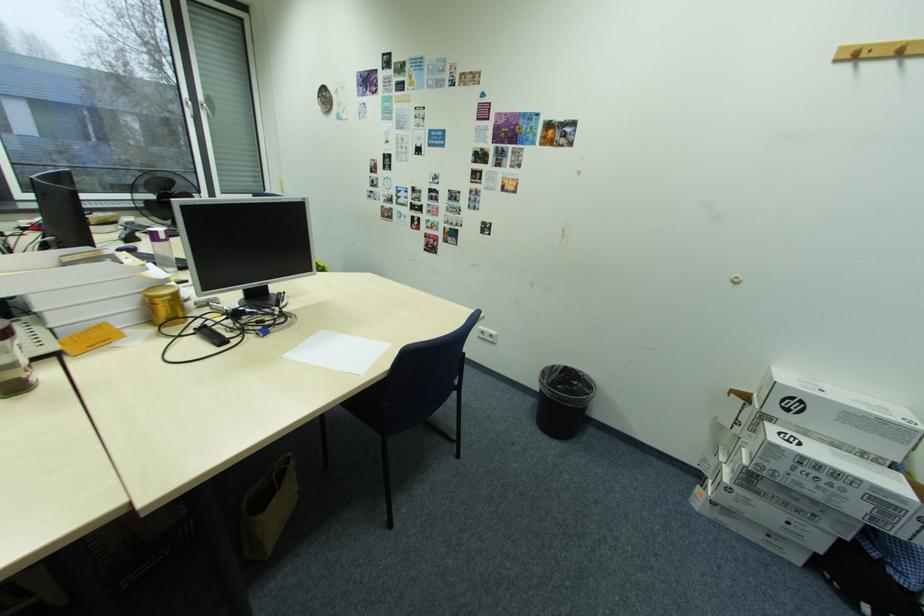
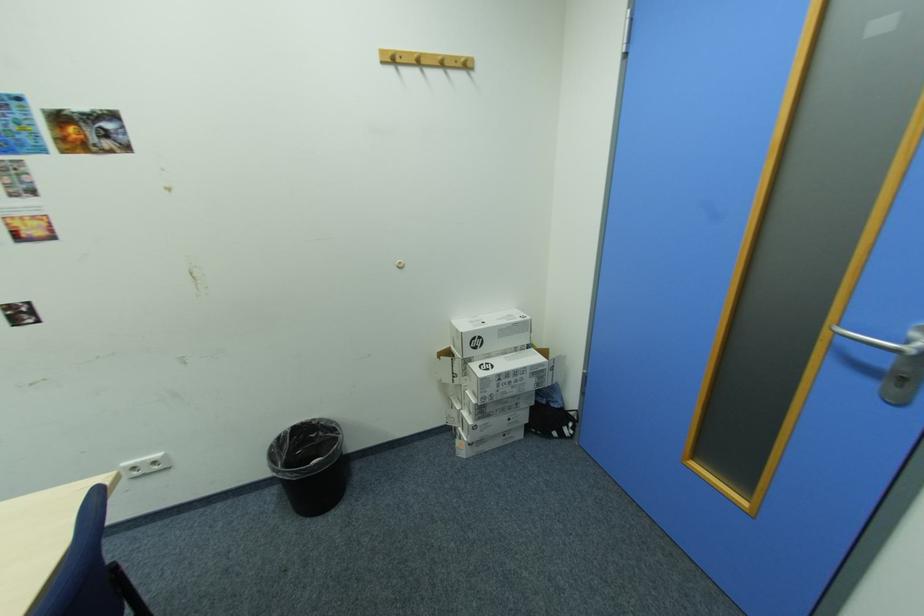
Where in the second image is the point corresponding to the point at 779,379 from the first image?

(465, 331)